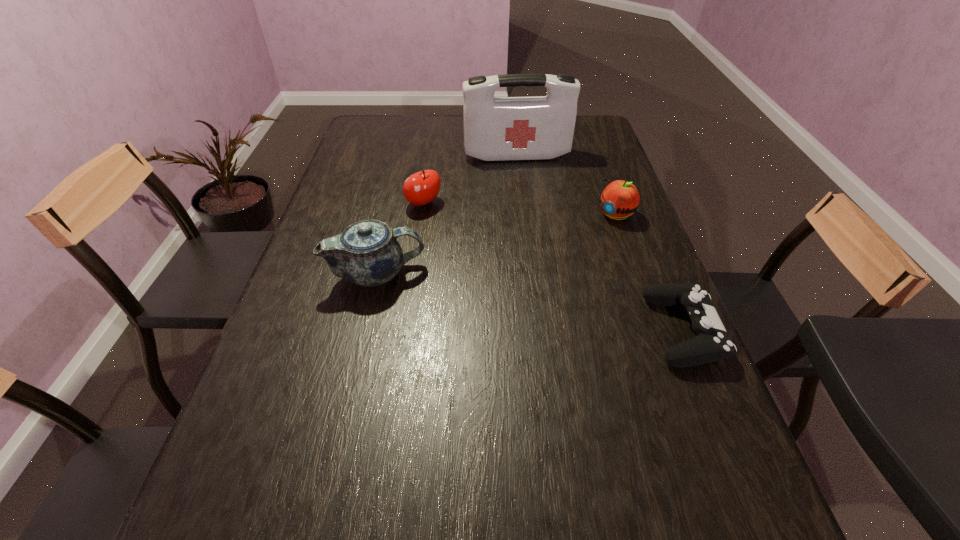
I want to click on the fourth shortest object, so click(x=367, y=253).

At what (x,y) coordinates should I click in order to perform the action: click on the shortest object. Please return your answer as a coordinate pair (x, y). Looking at the image, I should click on (712, 343).

At what (x,y) coordinates should I click in order to perform the action: click on the left apple. Please return your answer as a coordinate pair (x, y). This screenshot has height=540, width=960. Looking at the image, I should click on [421, 188].

I want to click on the right apple, so click(x=620, y=199).

I want to click on the first-aid kit, so click(538, 127).

Image resolution: width=960 pixels, height=540 pixels. I want to click on the farthest object, so click(538, 127).

The image size is (960, 540). What are the coordinates of `free space located 0.360m from the spout of the chinaware` in the screenshot? It's located at (569, 274).

You are a GUI agent. You are given a task and a screenshot of the screen. Output one action in this format:
    pyautogui.click(x=<x>, y=<y>)
    Task: Click on the vacant space located on the stem of the left apple
    This screenshot has height=540, width=960.
    Given the screenshot: What is the action you would take?
    pyautogui.click(x=444, y=222)

At what (x,y) coordinates should I click in order to perform the action: click on vacant space located 0.350m on the stem of the left apple. Please return your answer as a coordinate pair (x, y). Image resolution: width=960 pixels, height=540 pixels. Looking at the image, I should click on pos(506,283).

Where is `free space located 0.110m on the stem of the left apple`? This screenshot has width=960, height=540. free space located 0.110m on the stem of the left apple is located at coordinates (453, 232).